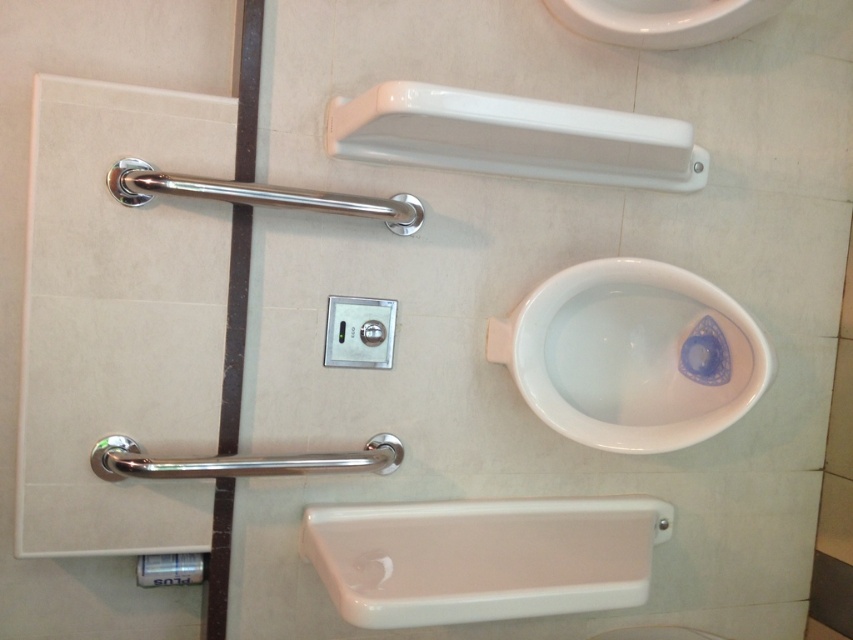
Question: Which of the following is the closest to the observer?

Choices:
 (A) (548, 282)
 (B) (561, 141)
 (C) (144, 557)

Answer: (B)

Question: Which object is positioned farthest from the white glossy sink at upper center?

Choices:
 (A) white glossy towel bar at upper center
 (B) white glossy toilet bowl at center

Answer: (B)

Question: Which point is farther to the camera?

Choices:
 (A) (758, 8)
 (B) (177, 557)

Answer: (A)

Question: Is white glossy toilet bowl at center to the right of white glossy towel bar at upper center from the viewer's perspective?

Choices:
 (A) yes
 (B) no

Answer: (A)

Question: Where is white glossy towel bar at upper center located in relation to white glossy sink at upper center in the image?

Choices:
 (A) above
 (B) below

Answer: (B)

Question: Does white glossy towel bar at upper center appear on the left side of white glossy sink at upper center?

Choices:
 (A) yes
 (B) no

Answer: (A)